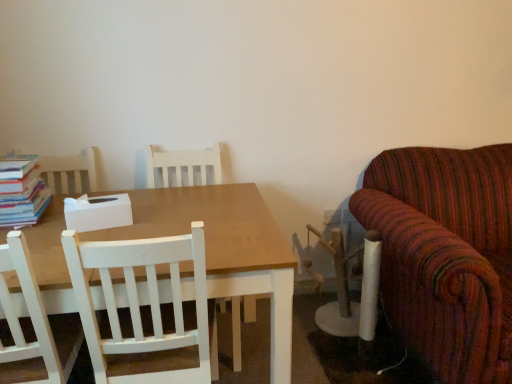
Question: Should I look upward or downward to see hardcover books at left?

Choices:
 (A) down
 (B) up

Answer: (B)

Question: Is white wood chair at center, which is counted as the 2th chair, starting from the back, not within white wood chair at center, the first chair when ordered from back to front?

Choices:
 (A) no
 (B) yes

Answer: (B)

Question: Does white wood chair at center, marked as the first chair in a front-to-back arrangement, appear on the right side of white wood chair at center, the first chair when ordered from back to front?

Choices:
 (A) yes
 (B) no

Answer: (B)

Question: Is white wood chair at center, which is counted as the 2th chair, starting from the back, facing away from white wood chair at center, the second chair positioned from the front?

Choices:
 (A) no
 (B) yes

Answer: (A)

Question: From the image's perspective, is white wood chair at center, which is counted as the 2th chair, starting from the back, under white wood chair at center, the second chair positioned from the front?

Choices:
 (A) no
 (B) yes

Answer: (B)

Question: Is white wood chair at center, the first chair when ordered from back to front, surrounded by white wood chair at center, which is counted as the 2th chair, starting from the back?

Choices:
 (A) no
 (B) yes

Answer: (A)

Question: Is white wood chair at center, marked as the first chair in a front-to-back arrangement, far away from white wood chair at center, the first chair when ordered from back to front?

Choices:
 (A) no
 (B) yes

Answer: (A)

Question: Is white wood chair at center, the first chair when ordered from back to front, turned away from white wood chair at center, marked as the first chair in a front-to-back arrangement?

Choices:
 (A) no
 (B) yes

Answer: (A)

Question: Is white wood chair at center, the second chair positioned from the front, not close to white wood chair at center, which is counted as the 2th chair, starting from the back?

Choices:
 (A) no
 (B) yes

Answer: (A)

Question: Does white wood chair at center, the second chair positioned from the front, have a larger size compared to white wood chair at center, marked as the first chair in a front-to-back arrangement?

Choices:
 (A) no
 (B) yes

Answer: (B)

Question: From the image's perspective, is white wood chair at center, the second chair positioned from the front, under white wood chair at center, marked as the first chair in a front-to-back arrangement?

Choices:
 (A) no
 (B) yes

Answer: (A)

Question: Is white wood chair at center, marked as the first chair in a front-to-back arrangement, a part of white wood chair at center, the first chair when ordered from back to front?

Choices:
 (A) no
 (B) yes

Answer: (A)

Question: Is the depth of white wood chair at center, the second chair positioned from the front, less than that of white wood chair at center, which is counted as the 2th chair, starting from the back?

Choices:
 (A) yes
 (B) no

Answer: (B)

Question: Considering the relative sizes of hardcover books at left and white wood chair at center, which is counted as the 2th chair, starting from the back, in the image provided, is hardcover books at left taller than white wood chair at center, which is counted as the 2th chair, starting from the back,?

Choices:
 (A) yes
 (B) no

Answer: (B)